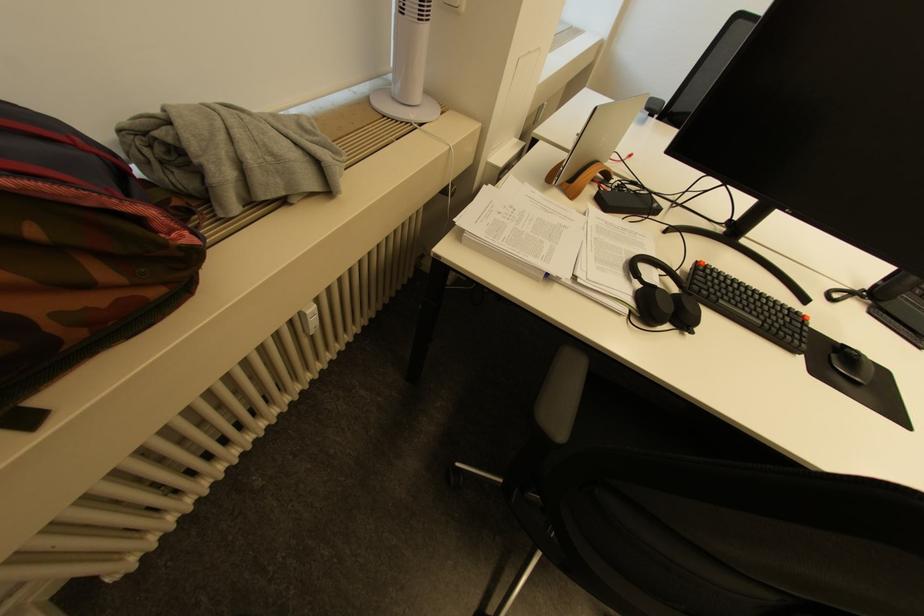
The width and height of the screenshot is (924, 616). In order to click on black headphones in this screenshot , I will do `click(663, 298)`.